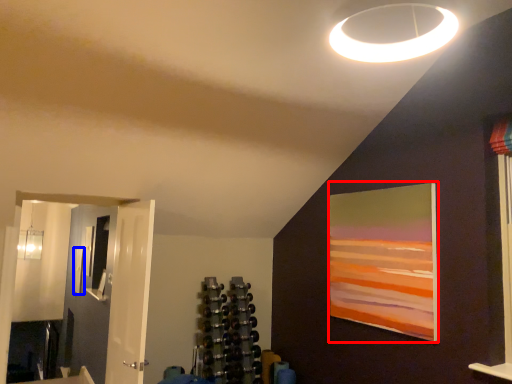
Question: Which object is closer to the camera taking this photo, picture frame (highlighted by a red box) or picture frame (highlighted by a blue box)?

Choices:
 (A) picture frame
 (B) picture frame

Answer: (A)